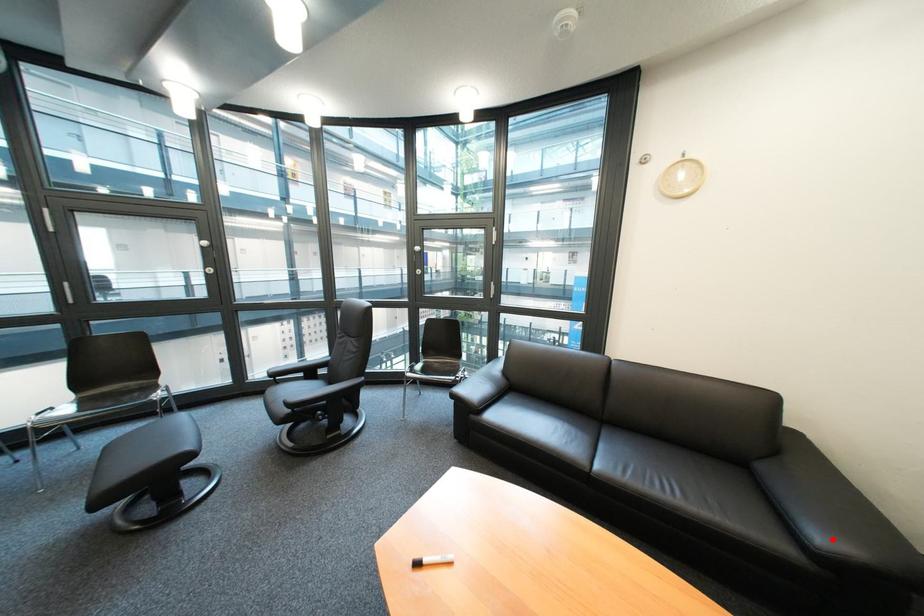
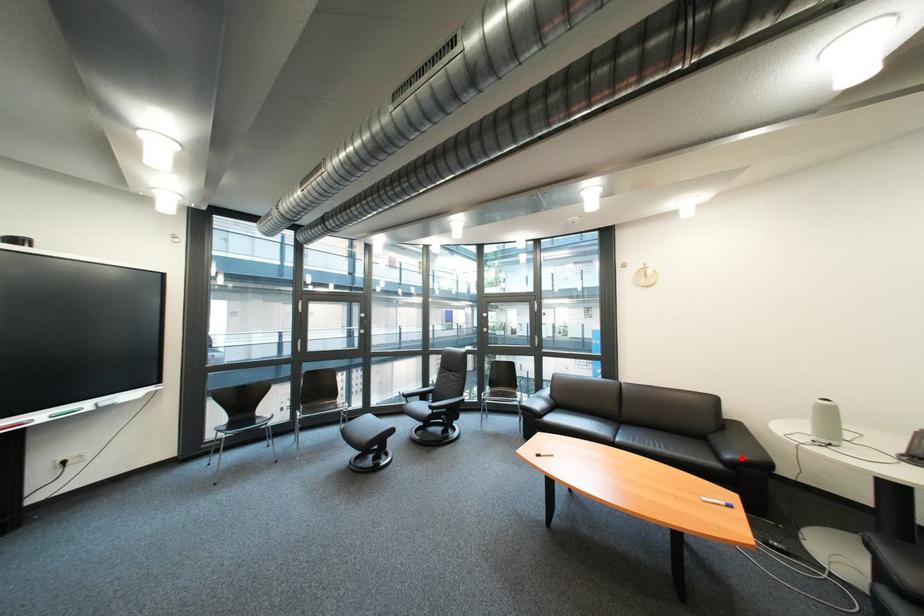
Consider the image. I am providing you with two images of the same scene from different viewpoints. A red point is marked on the first image and another point is marked on the second image. Is the marked point in image1 the same physical position as the marked point in image2?

Yes